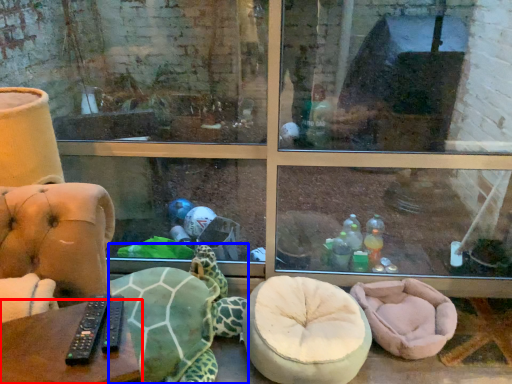
Question: Which object is closer to the camera taking this photo, table (highlighted by a red box) or tortoise (highlighted by a blue box)?

Choices:
 (A) table
 (B) tortoise

Answer: (A)